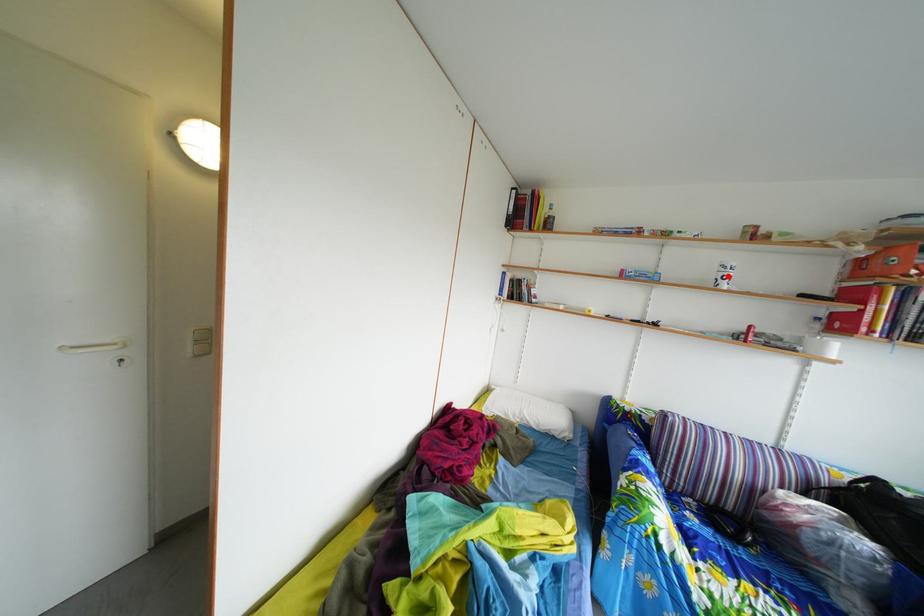
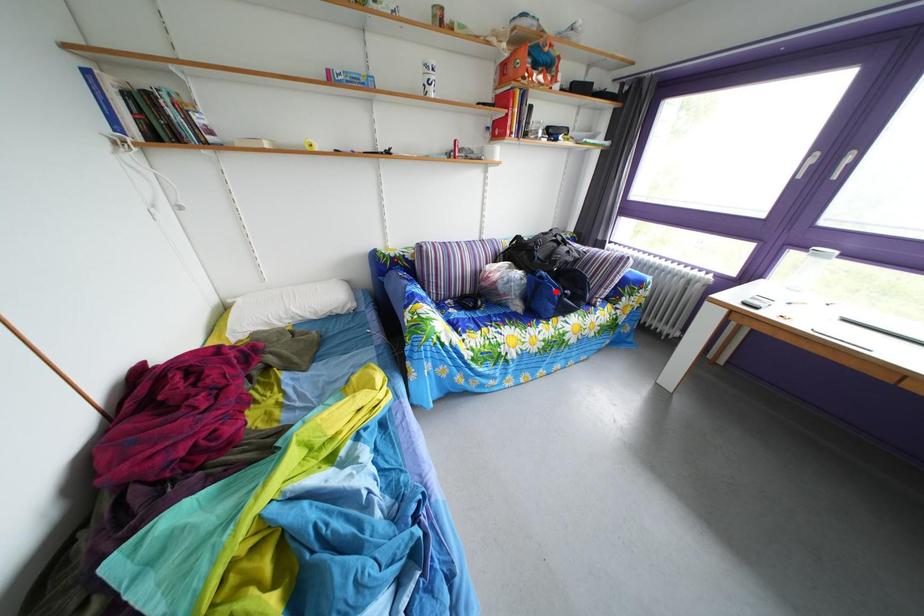
I am providing you with two images of the same scene from different viewpoints. A red point is marked on the first image and another point is marked on the second image. Are the points marked in image1 and image2 representing the same 3D position?

No